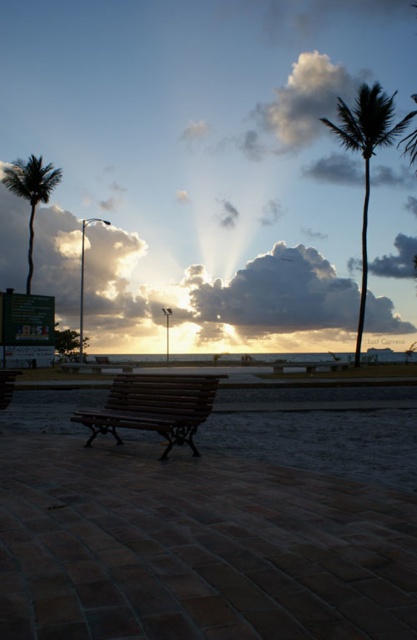
You are standing at point (273, 296) in the coastal scene. What object is located exactly at your current position?

The sandy yellow cloud at center is located exactly at point (273, 296).

You are standing on the walkway and want to take a photo of the green leafy palm tree at right. Which object, the sandy yellow cloud at center or the palm tree, will appear closer to you in the photo?

The sandy yellow cloud at center will appear closer in the photo because it is positioned closer to the viewer than the green leafy palm tree at right.

Based on the scene description, where is the white fluffy cloud at upper center located in terms of coordinates?

The white fluffy cloud at upper center is located at coordinates point [299,104].